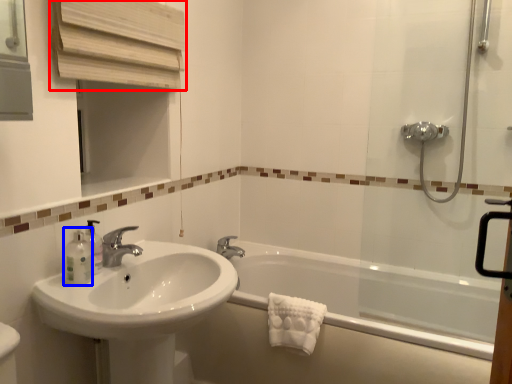
Question: Which of the following is the closest to the observer, medicine cabinet (highlighted by a red box) or toiletry (highlighted by a blue box)?

Choices:
 (A) medicine cabinet
 (B) toiletry

Answer: (A)